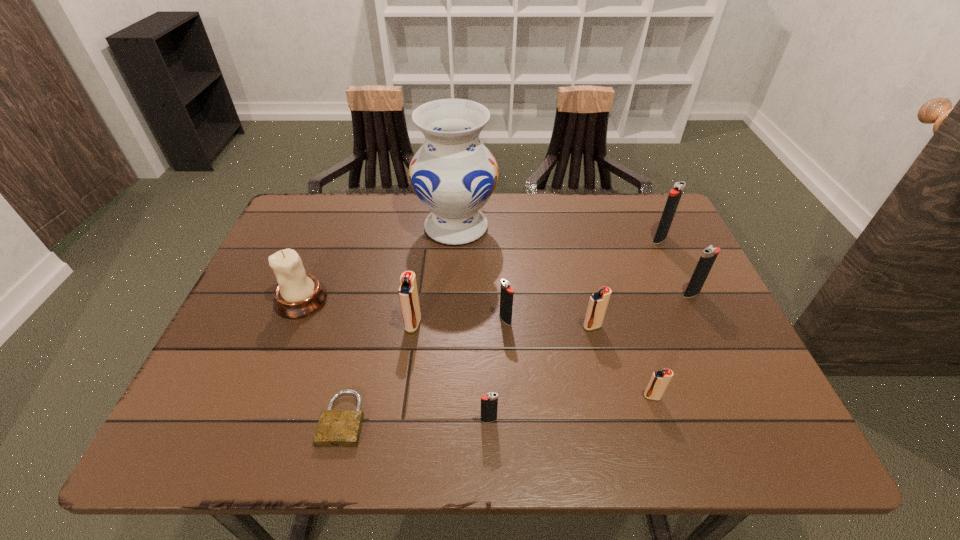
Where is `vacant area that lies between the tallest object and the nearest igniter`? The width and height of the screenshot is (960, 540). vacant area that lies between the tallest object and the nearest igniter is located at coordinates (472, 323).

Locate an element on the screen. vacant region between the fourth igniter from right to left and the leftmost red igniter is located at coordinates (503, 325).

This screenshot has height=540, width=960. What are the coordinates of `object that ranks as the seventh closest to the ninth object from right to left` in the screenshot? It's located at (659, 381).

Identify which object is the second closest to the white candle holder. Please provide its 2D coordinates. Your answer should be formatted as a tuple, i.e. [(x, y)], where the tuple contains the x and y coordinates of a point satisfying the conditions above.

[(336, 428)]

You are a GUI agent. You are given a task and a screenshot of the screen. Output one action in this format:
    pyautogui.click(x=<x>, y=<y>)
    Task: Click on the igniter that is the second closest one to the biggest red igniter
    This screenshot has width=960, height=540.
    Given the screenshot: What is the action you would take?
    pyautogui.click(x=489, y=403)

This screenshot has width=960, height=540. I want to click on the sixth closest igniter to the fifth igniter from left to right, so click(x=408, y=294).

Image resolution: width=960 pixels, height=540 pixels. Find the location of `black igniter that can be found as the second closest to the third igniter from left to right`. black igniter that can be found as the second closest to the third igniter from left to right is located at coordinates (709, 254).

Identify which black igniter is the second nearest to the second red igniter from right to left. Please provide its 2D coordinates. Your answer should be formatted as a tuple, i.e. [(x, y)], where the tuple contains the x and y coordinates of a point satisfying the conditions above.

[(709, 254)]

The image size is (960, 540). I want to click on red igniter that stands as the third closest to the tallest object, so click(659, 381).

You are a GUI agent. You are given a task and a screenshot of the screen. Output one action in this format:
    pyautogui.click(x=<x>, y=<y>)
    Task: Click on the second closest red igniter to the second object from left to right
    
    Given the screenshot: What is the action you would take?
    pyautogui.click(x=598, y=302)